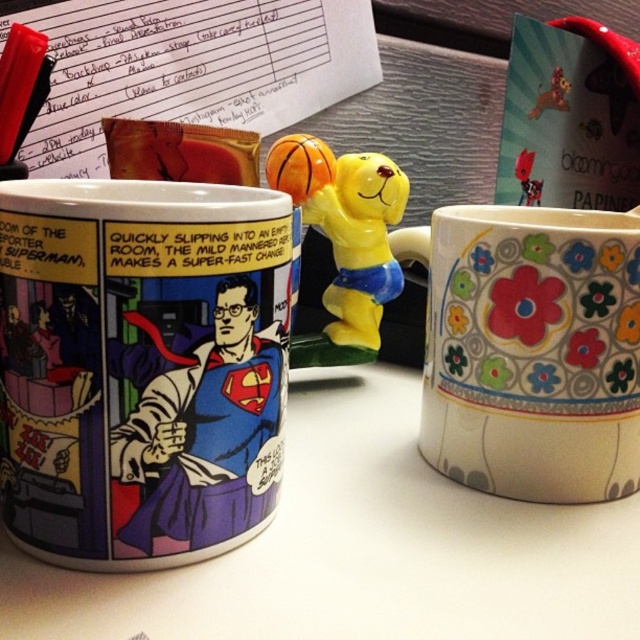
Looking at this image, does yellow matte basketball player at center come in front of black plastic pen at upper left?

No.

Does point (337, 305) come farther from viewer compared to point (19, 51)?

Yes.

Does point (384, 280) come farther from viewer compared to point (24, 77)?

Yes, it is behind point (24, 77).

Where is `yellow matte basketball player at center`? The width and height of the screenshot is (640, 640). yellow matte basketball player at center is located at coordinates (344, 240).

Who is more forward, (125,433) or (19,45)?

Point (125,433) is more forward.

Is point (272, 332) positioned behind point (33, 52)?

That is False.

What are the coordinates of `superman comic at center` in the screenshot? It's located at (205, 433).

Who is positioned more to the right, comic book print mug at center or yellow matte basketball player at center?

yellow matte basketball player at center

Can you confirm if comic book print mug at center is positioned below yellow matte basketball player at center?

Correct, comic book print mug at center is located below yellow matte basketball player at center.

Is point (180, 246) positioned after point (292, 164)?

No, (180, 246) is in front of (292, 164).

The height and width of the screenshot is (640, 640). In order to click on comic book print mug at center in this screenshot , I will do `click(141, 368)`.